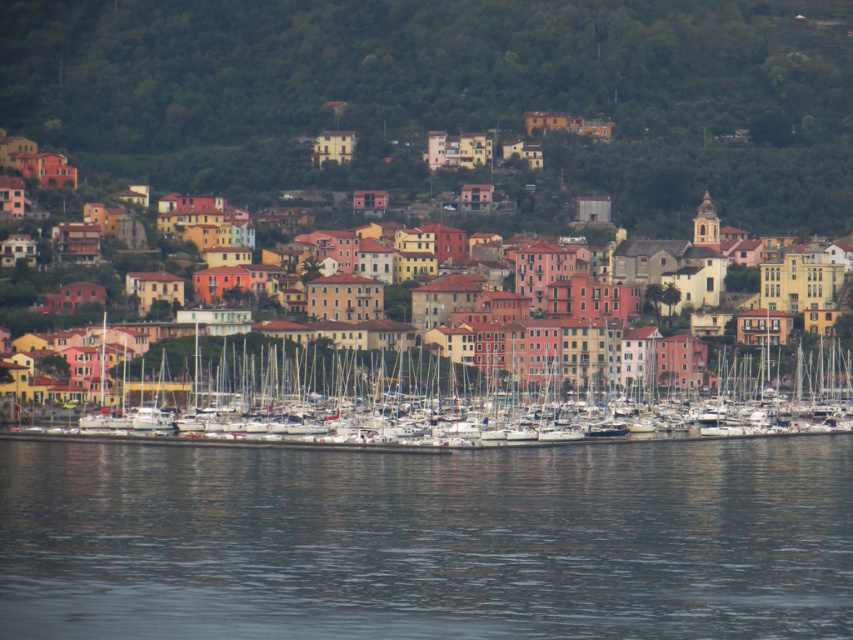
Can you confirm if dark gray water at lower center is positioned to the left of white matte boats at center?

Yes, dark gray water at lower center is to the left of white matte boats at center.

Where is `dark gray water at lower center`? The height and width of the screenshot is (640, 853). dark gray water at lower center is located at coordinates (428, 540).

Is dark gray water at lower center in front of multicolored buildings at center?

No, it is behind multicolored buildings at center.

The width and height of the screenshot is (853, 640). In order to click on dark gray water at lower center in this screenshot , I will do `click(428, 540)`.

The image size is (853, 640). Identify the location of dark gray water at lower center. (428, 540).

Can you confirm if white matte boats at center is wider than multicolored buildings at center?

In fact, white matte boats at center might be narrower than multicolored buildings at center.

Where is `white matte boats at center`? white matte boats at center is located at coordinates (445, 396).

The width and height of the screenshot is (853, 640). What are the coordinates of `white matte boats at center` in the screenshot? It's located at (445, 396).